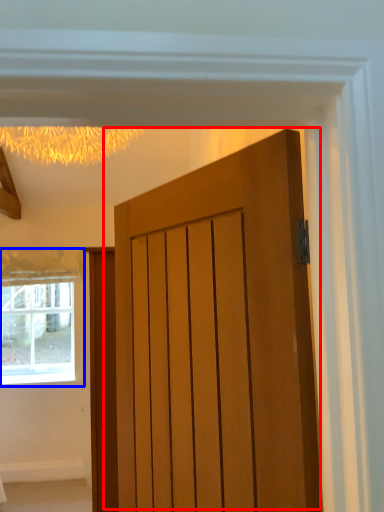
Question: Which point is further to the camera, door (highlighted by a red box) or window (highlighted by a blue box)?

Choices:
 (A) door
 (B) window

Answer: (B)